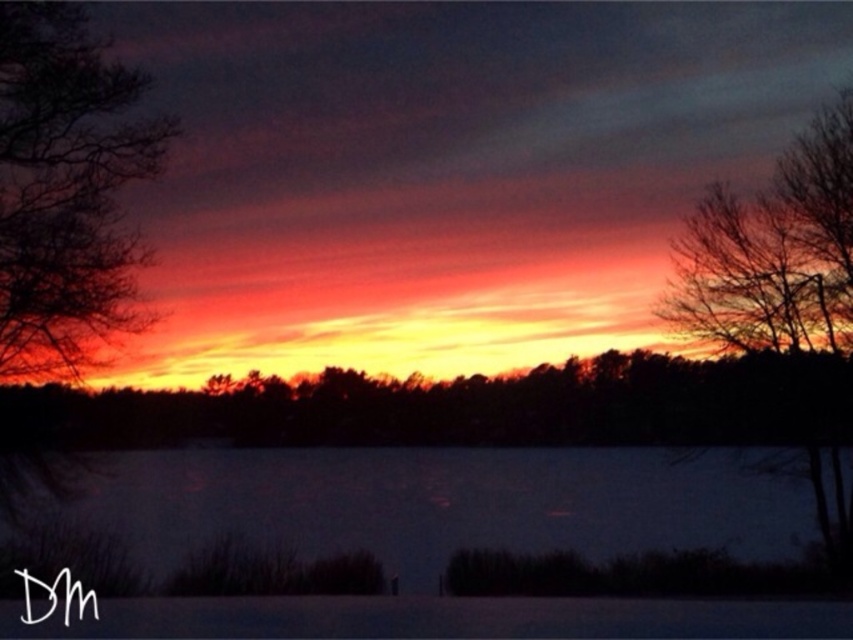
You are an artist sketching the sunset scene. You notice two silhouette bare trees in the foreground. Which tree has a larger width when comparing the silhouette bare tree at left and the silhouette bare tree at right?

The silhouette bare tree at left has a larger width than the silhouette bare tree at right.